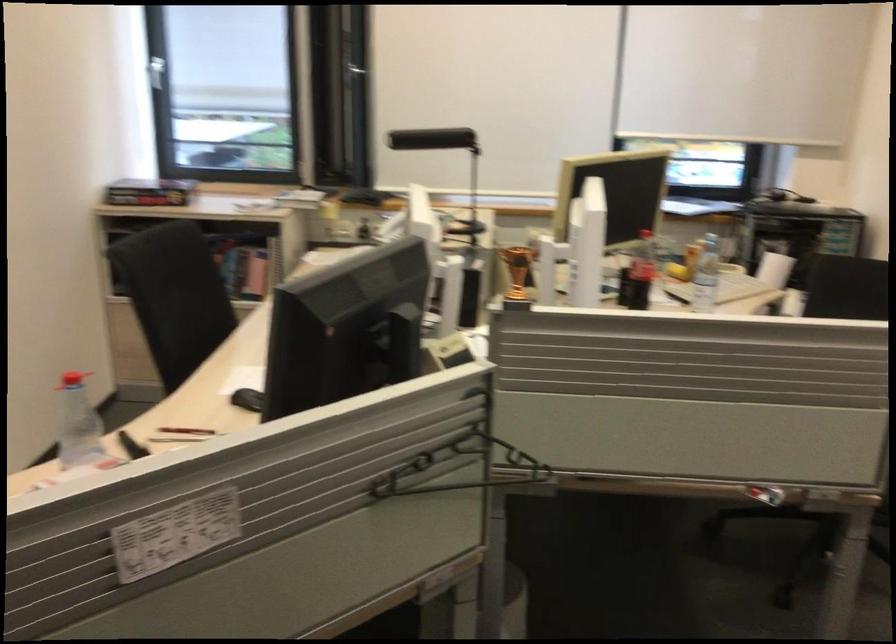
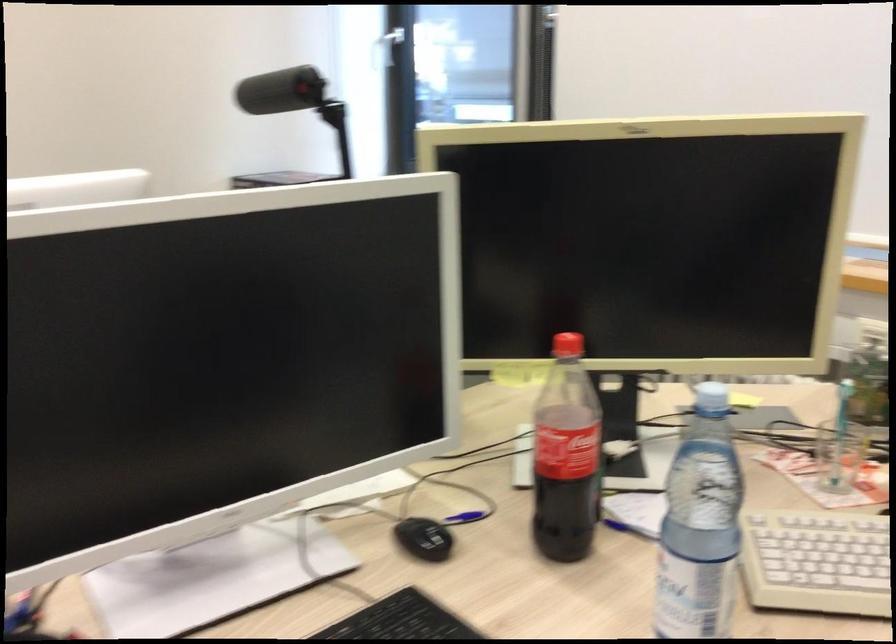
In the second image, find the point that corresponds to point 693,289 in the first image.

(815, 562)